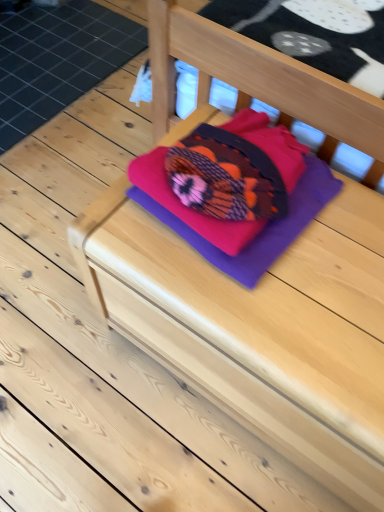
What do you see at coordinates (255, 395) in the screenshot? This screenshot has height=512, width=384. I see `purple matte drawer at center` at bounding box center [255, 395].

Identify the location of purple matte drawer at center. Image resolution: width=384 pixels, height=512 pixels. (255, 395).

This screenshot has width=384, height=512. What are the coordinates of `purple matte drawer at center` in the screenshot? It's located at (255, 395).